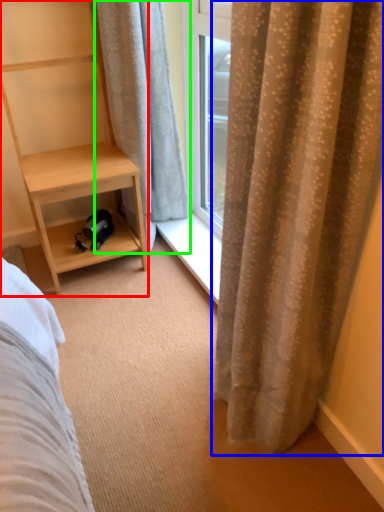
Question: Estimate the real-world distances between objects in this image. Which object is farther from shelf (highlighted by a red box), curtain (highlighted by a blue box) or curtain (highlighted by a green box)?

Choices:
 (A) curtain
 (B) curtain

Answer: (A)